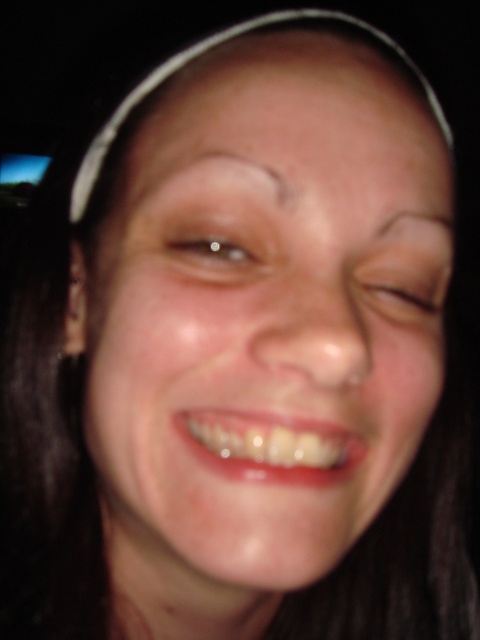
Question: Which object is closer to the camera taking this photo?

Choices:
 (A) brown matte eyebrow at upper center
 (B) smooth skin at center
 (C) clear crystal eye at center

Answer: (A)

Question: Can you confirm if brown matte eye at center is wider than clear crystal eye at center?

Choices:
 (A) no
 (B) yes

Answer: (B)

Question: Can you confirm if smooth skin face at center is positioned below dark brown eyebrow at upper center?

Choices:
 (A) yes
 (B) no

Answer: (A)

Question: Which point is closer to the camera?

Choices:
 (A) smooth skin at center
 (B) smooth skin face at center

Answer: (B)

Question: Can you confirm if smooth skin at center is smaller than dark brown eyebrow at upper center?

Choices:
 (A) no
 (B) yes

Answer: (A)

Question: Which object appears closest to the camera in this image?

Choices:
 (A) smooth skin nose at center
 (B) dark brown eyebrow at upper center
 (C) smooth skin face at center
 (D) smooth skin at center

Answer: (C)